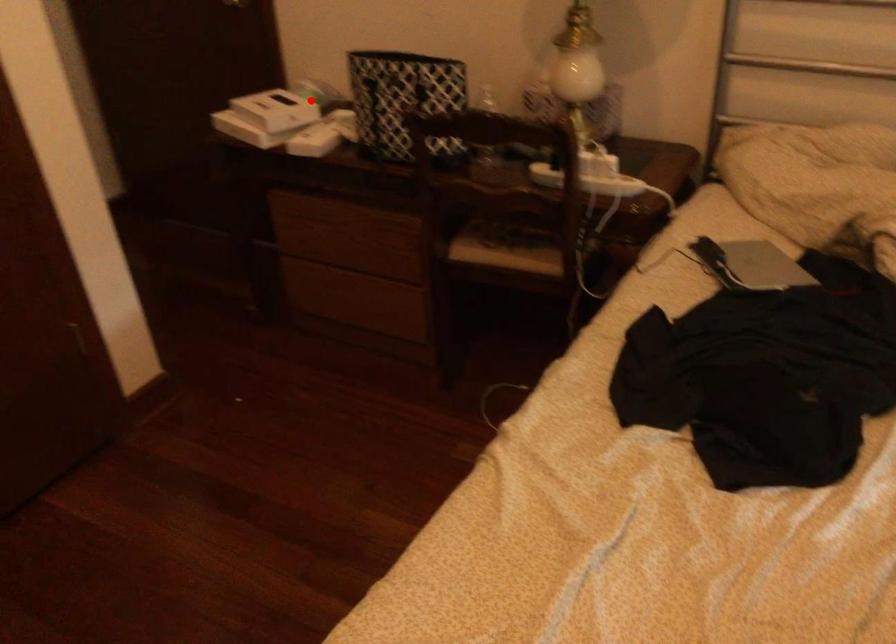
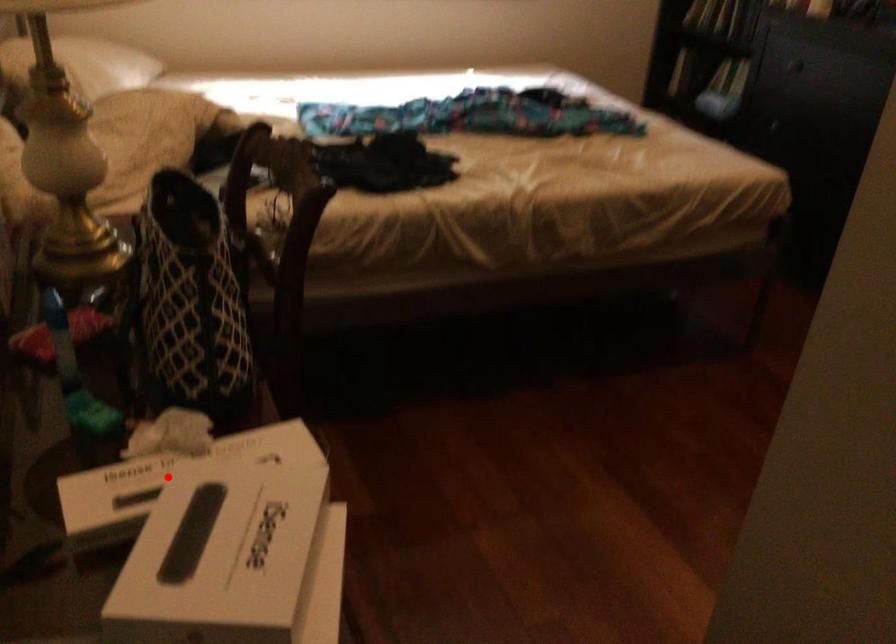
I am providing you with two images of the same scene from different viewpoints. A red point is marked on the first image and another point is marked on the second image. Does the point marked in image1 correspond to the same location as the one in image2?

Yes